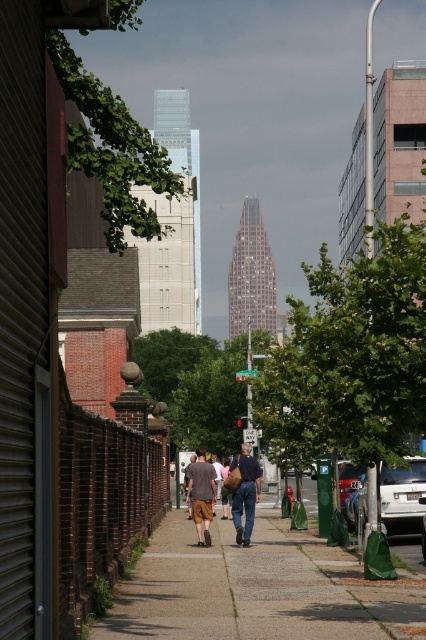
How much distance is there between brown canvas bag at center and denim jeans at center?

brown canvas bag at center is 8.91 inches away from denim jeans at center.

Does brown canvas bag at center have a lesser width compared to denim jeans at center?

No, brown canvas bag at center is not thinner than denim jeans at center.

Does point (198, 460) come behind point (247, 483)?

Yes, point (198, 460) is behind point (247, 483).

Locate an element on the screen. brown canvas bag at center is located at coordinates (245, 492).

Who is positioned more to the right, gray concrete sidewalk at center or brown canvas bag at center?

gray concrete sidewalk at center is more to the right.

Who is higher up, gray concrete sidewalk at center or brown canvas bag at center?

Positioned higher is brown canvas bag at center.

Who is more forward, (290, 564) or (192, 477)?

Positioned in front is point (290, 564).

At what (x,y) coordinates should I click in order to perform the action: click on gray concrete sidewalk at center. Please return your answer as a coordinate pair (x, y). Looking at the image, I should click on (253, 588).

Does brown fabric shorts at center appear under metallic silver car at center?

Incorrect, brown fabric shorts at center is not positioned below metallic silver car at center.

Who is lower down, brown fabric shorts at center or metallic silver car at center?

Positioned lower is metallic silver car at center.

What do you see at coordinates (201, 493) in the screenshot?
I see `brown fabric shorts at center` at bounding box center [201, 493].

Where is `brown fabric shorts at center`? This screenshot has height=640, width=426. brown fabric shorts at center is located at coordinates click(x=201, y=493).